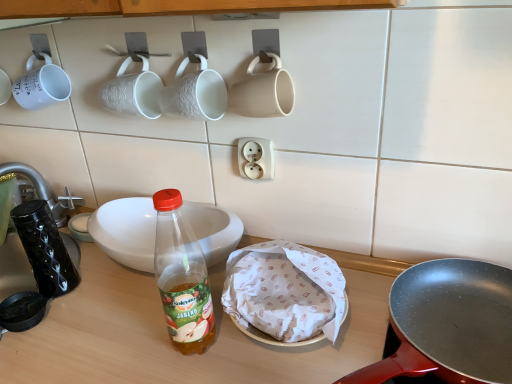
Question: Does matte black frying pan at center right have a larger size compared to white matte mug at upper left, the 1th coffee cup from the left?

Choices:
 (A) no
 (B) yes

Answer: (B)

Question: Is matte black frying pan at center right next to white matte mug at upper left, the 1th coffee cup from the left, and touching it?

Choices:
 (A) no
 (B) yes

Answer: (A)

Question: Considering the relative sizes of matte black frying pan at center right and white matte mug at upper left, the 1th coffee cup from the left, in the image provided, is matte black frying pan at center right wider than white matte mug at upper left, the 1th coffee cup from the left,?

Choices:
 (A) no
 (B) yes

Answer: (B)

Question: Is matte black frying pan at center right oriented away from white matte mug at upper left, the 1th coffee cup from the left?

Choices:
 (A) no
 (B) yes

Answer: (A)

Question: From the image's perspective, is matte black frying pan at center right beneath white matte mug at upper left, the fourth coffee cup positioned from the right?

Choices:
 (A) no
 (B) yes

Answer: (B)

Question: From the image's perspective, is translucent plastic bottle at center above or below white ceramic bowl at center?

Choices:
 (A) below
 (B) above

Answer: (A)

Question: From a real-world perspective, is translucent plastic bottle at center positioned above or below white ceramic bowl at center?

Choices:
 (A) below
 (B) above

Answer: (A)

Question: Considering the positions of translucent plastic bottle at center and white ceramic bowl at center in the image, is translucent plastic bottle at center taller or shorter than white ceramic bowl at center?

Choices:
 (A) short
 (B) tall

Answer: (B)

Question: Considering the positions of point (215, 268) and point (103, 215), is point (215, 268) closer or farther from the camera than point (103, 215)?

Choices:
 (A) farther
 (B) closer

Answer: (B)

Question: In the image, is translucent plastic bottle at center positioned in front of or behind white matte mug at upper left, the 1th coffee cup from the left?

Choices:
 (A) behind
 (B) front

Answer: (B)

Question: From the image's perspective, is translucent plastic bottle at center positioned above or below white matte mug at upper left, the fourth coffee cup positioned from the right?

Choices:
 (A) above
 (B) below

Answer: (B)

Question: From a real-world perspective, is translucent plastic bottle at center physically located above or below white matte mug at upper left, the fourth coffee cup positioned from the right?

Choices:
 (A) below
 (B) above

Answer: (A)

Question: In terms of width, does translucent plastic bottle at center look wider or thinner when compared to white matte mug at upper left, the fourth coffee cup positioned from the right?

Choices:
 (A) wide
 (B) thin

Answer: (B)

Question: Considering the relative positions of white textured mug at upper center, the second coffee cup positioned from the right, and white paper wrapped food at center in the image provided, is white textured mug at upper center, the second coffee cup positioned from the right, to the left or to the right of white paper wrapped food at center?

Choices:
 (A) right
 (B) left

Answer: (B)

Question: Looking at their shapes, would you say white textured mug at upper center, the third coffee cup positioned from the left, is wider or thinner than white paper wrapped food at center?

Choices:
 (A) thin
 (B) wide

Answer: (A)